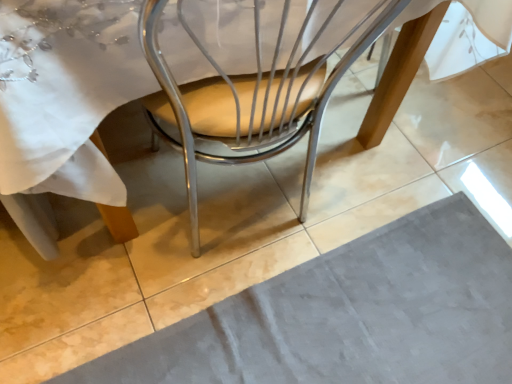
I want to click on free space above gray velvety place mat at lower center (from a real-world perspective), so click(x=364, y=322).